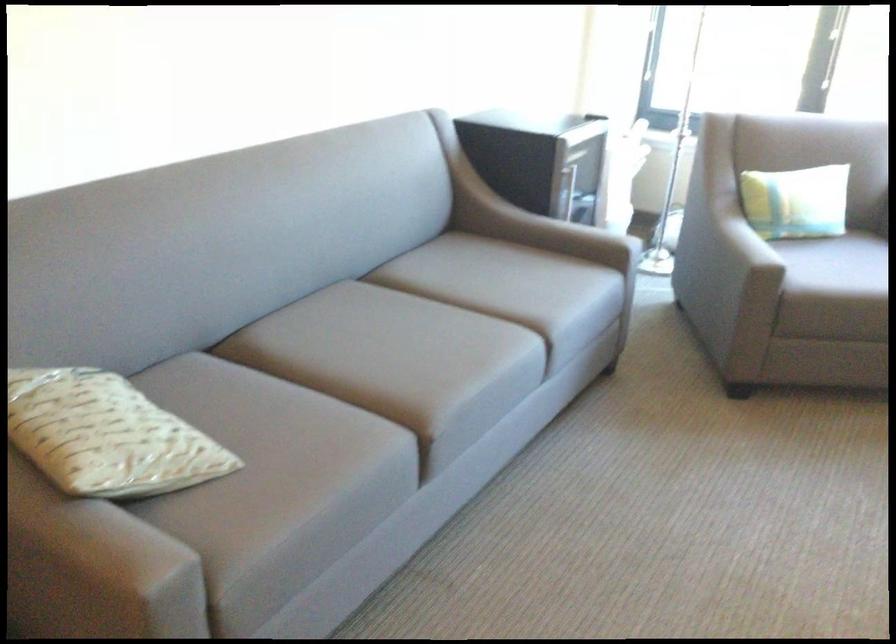
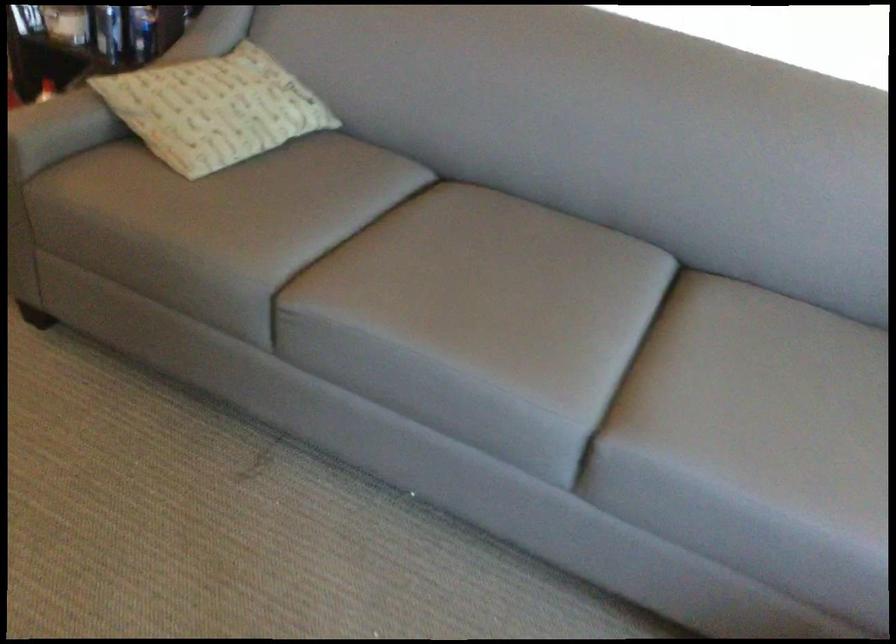
Locate, in the second image, the point that corresponds to (406,346) in the first image.

(479, 290)